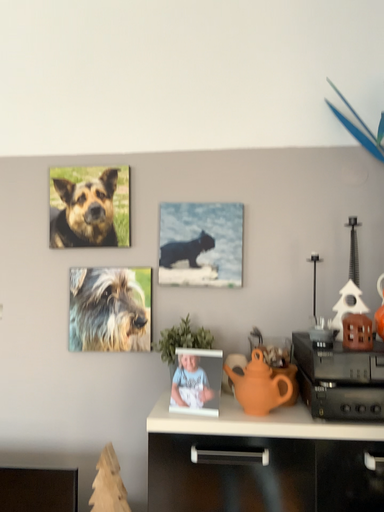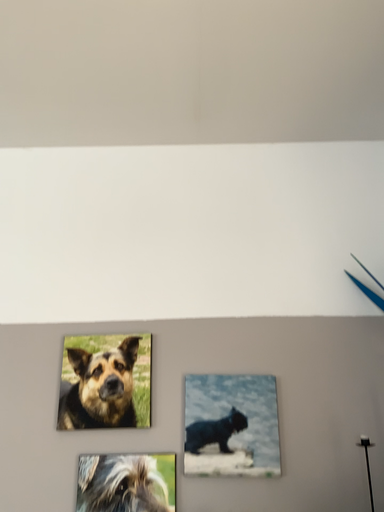
Question: How did the camera likely rotate when shooting the video?

Choices:
 (A) rotated upward
 (B) rotated downward

Answer: (A)